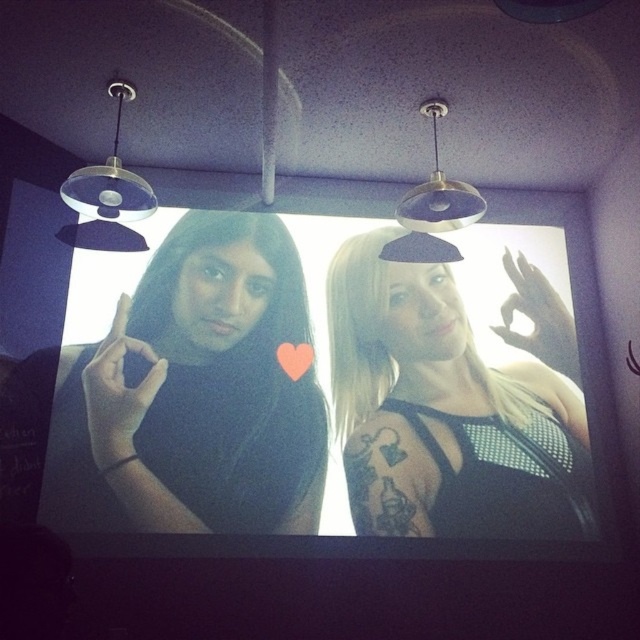
You are designing a layout for a poster that needs to include both the black matte shirt at left and the black mesh top at center. Based on their sizes in the image, which one should you place higher up to maintain visual balance?

The black matte shirt at left is taller than the black mesh top at center, so placing the black matte shirt at left higher up will help maintain visual balance by compensating for its greater height.

You are an interior designer planning to place a new decorative item between the black matte shirt at left and the black mesh top at center. Based on their positions, where should you place the item to ensure it is centered between them?

The black matte shirt at left is positioned over the black mesh top at center, so placing the decorative item directly above the black mesh top at center would center it between both objects.

You are an AI analyzing a photo of two people on a projection screen. The scene has purple walls and two modern pendant lights. You need to determine where a specific point is located. The point is at coordinates point (195,394). Which object from the scene does this point belong to?

The point (195,394) is on the black matte shirt at left.